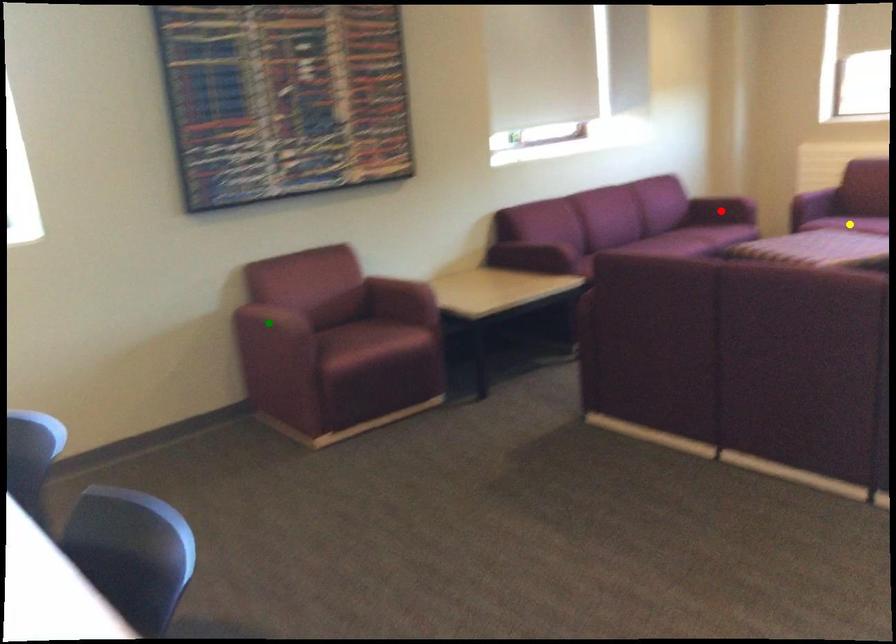
Order these from farthest to nearest:
green point
yellow point
red point

red point
yellow point
green point